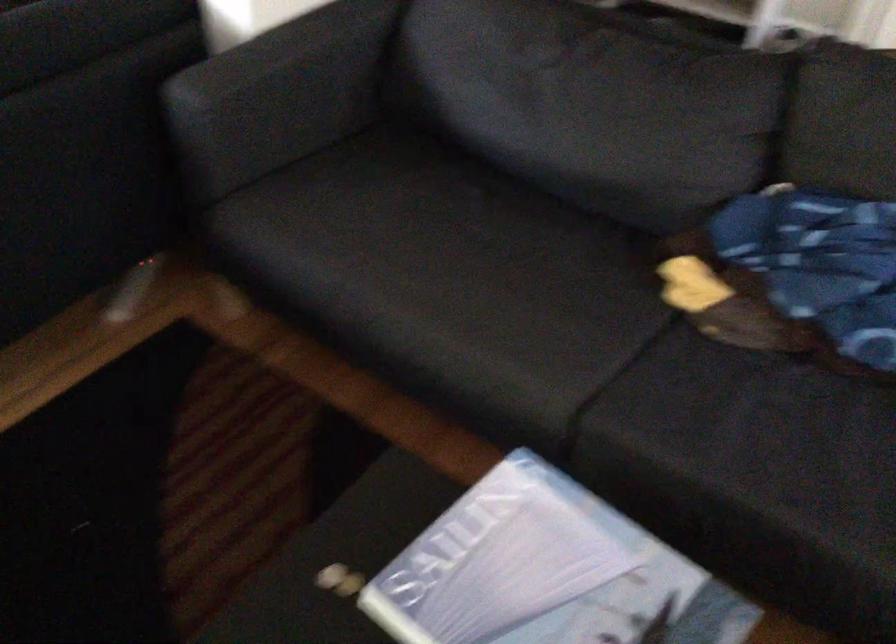
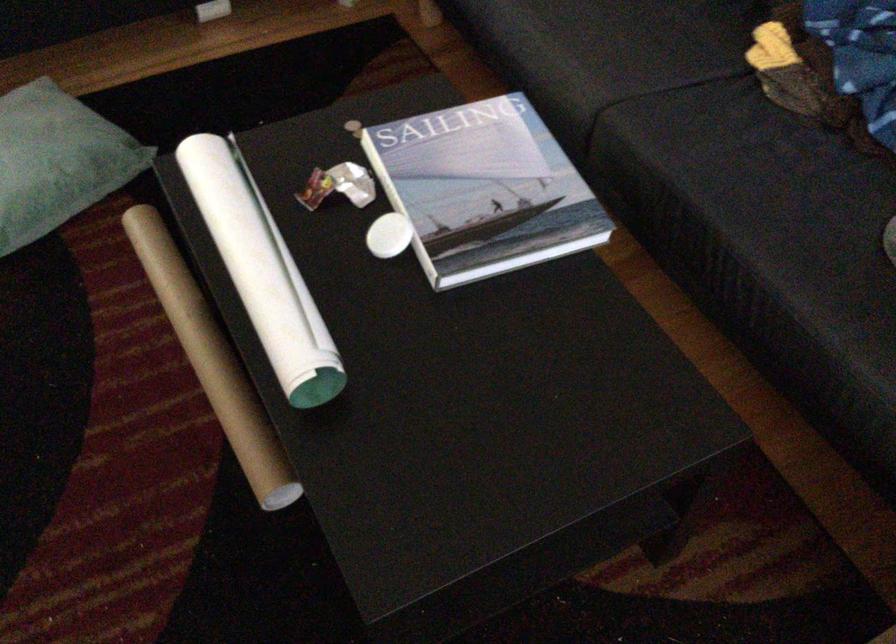
The point at (751,308) is marked in the first image. Where is the corresponding point in the second image?

(808, 77)